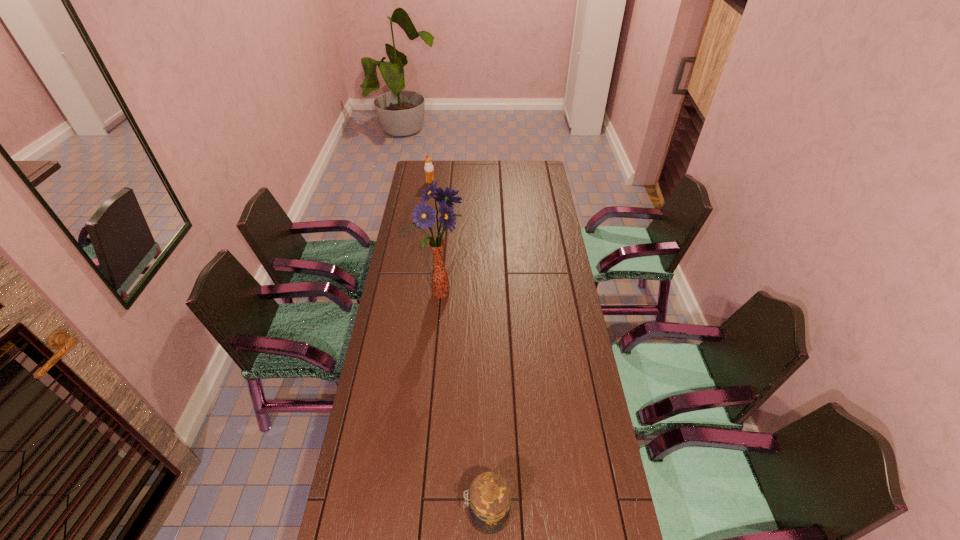
Find the location of a particular element. object situated at the far edge is located at coordinates (428, 168).

This screenshot has height=540, width=960. Find the location of `flower arrangement that is at the left edge`. flower arrangement that is at the left edge is located at coordinates (423, 215).

Find the location of a particular element. icecream situated at the left edge is located at coordinates (428, 168).

At what (x,y) coordinates should I click in order to perform the action: click on object located in the far left corner section of the desktop. Please return your answer as a coordinate pair (x, y). The image size is (960, 540). Looking at the image, I should click on (428, 168).

In order to click on free space at the far edge of the desktop in this screenshot , I will do `click(506, 161)`.

The image size is (960, 540). Find the location of `free space at the left edge of the desktop`. free space at the left edge of the desktop is located at coordinates [414, 387].

Locate an element on the screen. This screenshot has height=540, width=960. free spot at the right edge of the desktop is located at coordinates (536, 211).

Where is `vacant space at the far left corner of the desktop`? The width and height of the screenshot is (960, 540). vacant space at the far left corner of the desktop is located at coordinates (441, 177).

Image resolution: width=960 pixels, height=540 pixels. In the image, there is a desktop. Find the location of `vacant space at the far right corner`. vacant space at the far right corner is located at coordinates (549, 181).

The width and height of the screenshot is (960, 540). I want to click on free spot between the rightmost object and the second farthest object, so click(463, 404).